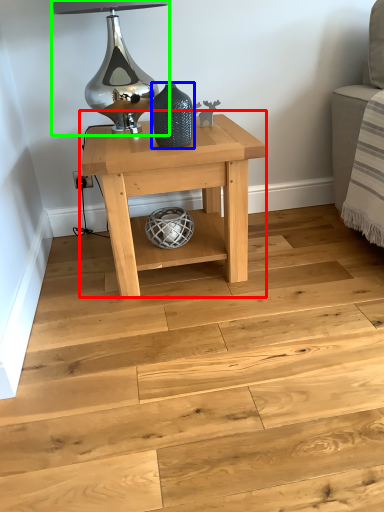
Question: Based on their relative distances, which object is nearer to table (highlighted by a red box)? Choose from vase (highlighted by a blue box) and table lamp (highlighted by a green box).

Choices:
 (A) vase
 (B) table lamp

Answer: (A)